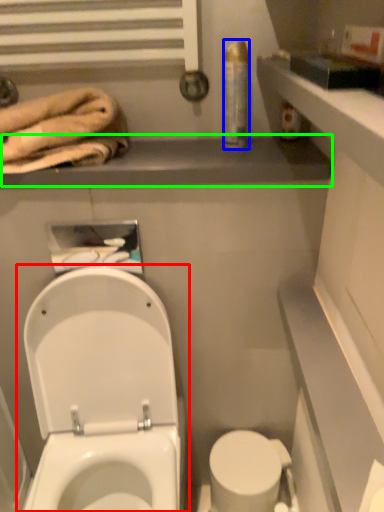
Question: Considering the real-world distances, which object is farthest from toilet (highlighted by a red box)? toiletry (highlighted by a blue box) or balustrade (highlighted by a green box)?

Choices:
 (A) toiletry
 (B) balustrade

Answer: (A)